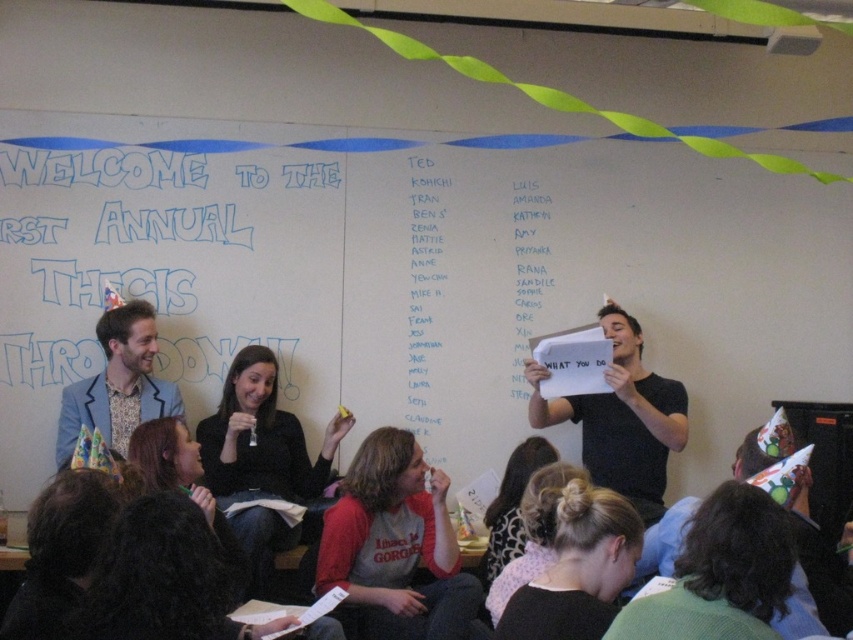
You are a guest at the event and want to read both the whiteboard at upper center and the white paper list at center. If you can only move your head 18 inches to the side, can you comfortably read both without moving your body?

The whiteboard at upper center and white paper list at center are 26.77 inches apart from each other. Since you can only move your head 18 inches to the side, you cannot comfortably read both without moving your body because the distance between them exceeds your head movement range.

You are standing in the room and want to read the text on the whiteboard at upper center and the white paper list at center. Which one can you read more clearly?

The whiteboard at upper center is closer to the viewer than the white paper list at center, so you can read the whiteboard at upper center more clearly.